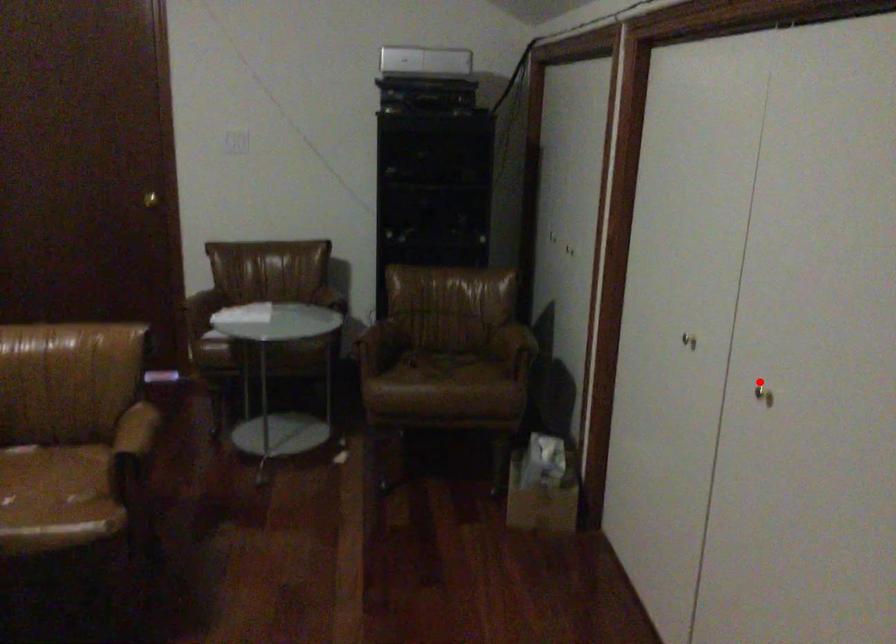
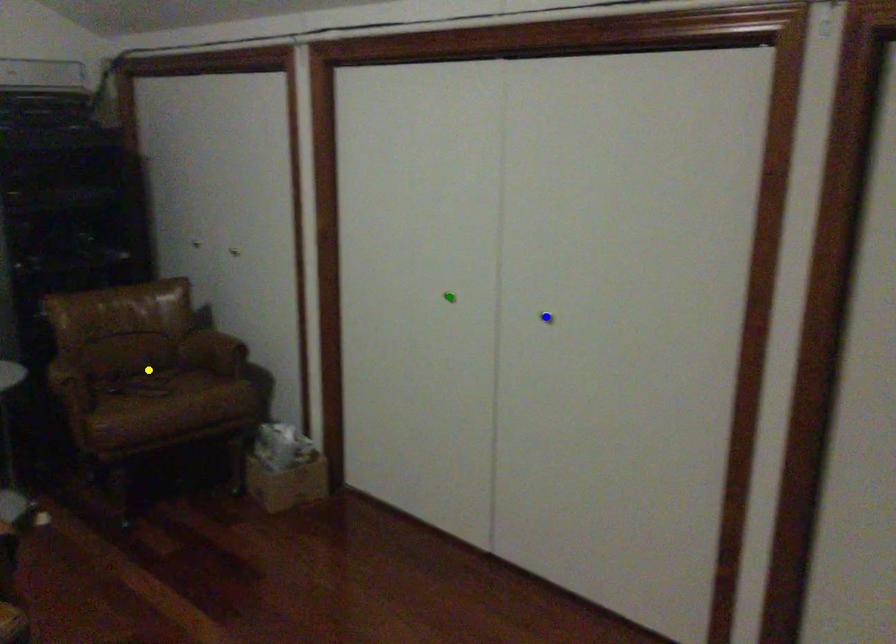
Question: I am providing you with two images of the same scene from different viewpoints. A red point is marked on the first image. You are given multiple points on the second image. Can you choose the point in image 2 that corresponds to the point in image 1?

Choices:
 (A) yellow point
 (B) blue point
 (C) green point

Answer: (B)